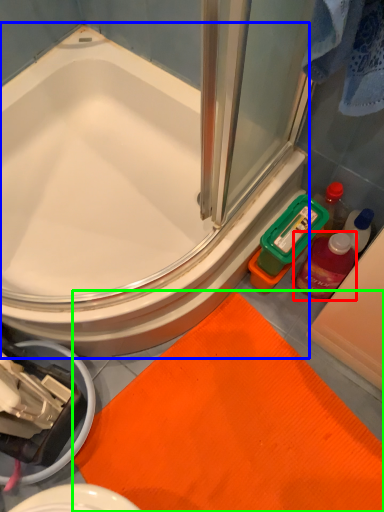
Question: Considering the real-world distances, which object is closest to mouthwash (highlighted by a red box)? bathtub (highlighted by a blue box) or bath mat (highlighted by a green box).

Choices:
 (A) bathtub
 (B) bath mat

Answer: (B)